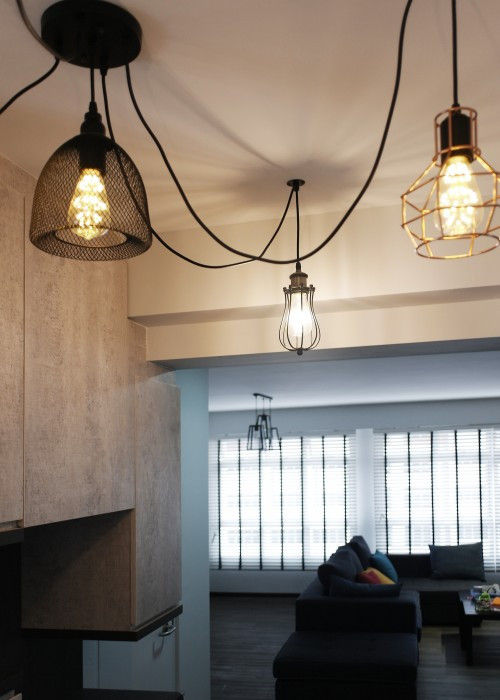
At what (x,y) coordinates should I click in order to perform the action: click on dark wooden floor. Please return your answer as a coordinate pair (x, y). Looking at the image, I should click on (261, 634).